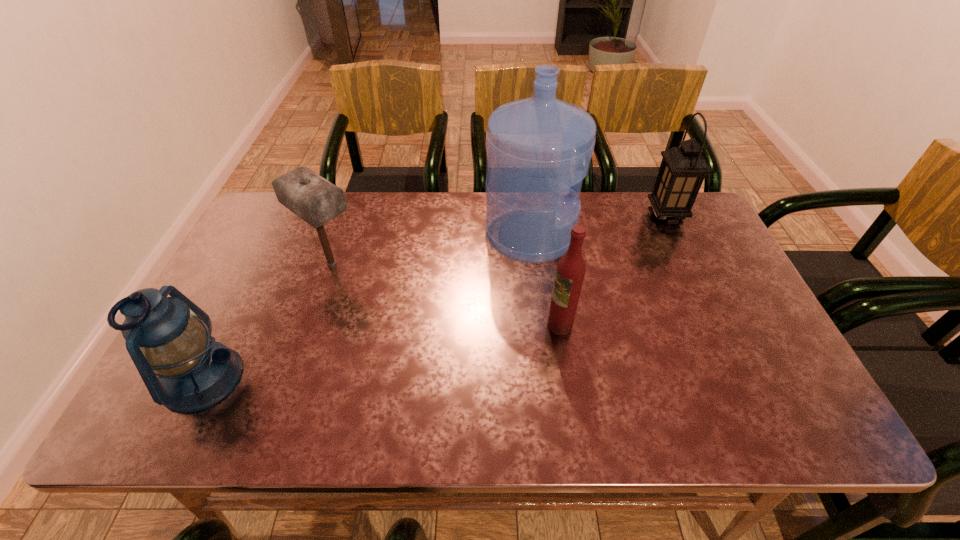
The image size is (960, 540). What are the coordinates of `object located at the far right corner` in the screenshot? It's located at (683, 169).

Where is `vacant space at the far edge of the desktop`? vacant space at the far edge of the desktop is located at coordinates (372, 218).

The height and width of the screenshot is (540, 960). Find the location of `vacant region at the near edge of the desktop`. vacant region at the near edge of the desktop is located at coordinates (565, 408).

At what (x,y) coordinates should I click in order to perform the action: click on vacant space at the left edge of the desktop. Please return your answer as a coordinate pair (x, y). Looking at the image, I should click on (292, 254).

At what (x,y) coordinates should I click in order to perform the action: click on vacant space at the right edge of the desktop. Please return your answer as a coordinate pair (x, y). The height and width of the screenshot is (540, 960). Looking at the image, I should click on (696, 264).

Identify the location of free location at the far left corner of the desktop. This screenshot has width=960, height=540. (275, 224).

Locate an element on the screen. The width and height of the screenshot is (960, 540). vacant area between the shorter lantern and the farther lantern is located at coordinates (434, 297).

Find the location of a particular element. The image size is (960, 540). free space between the tallest object and the mallet is located at coordinates (431, 249).

At what (x,y) coordinates should I click in order to perform the action: click on unoccupied area between the liquor and the second object from left to right. Please return your answer as a coordinate pair (x, y). This screenshot has height=540, width=960. Looking at the image, I should click on (445, 294).

What are the coordinates of `vacant space that is in between the tallest object and the second nearest object` in the screenshot? It's located at 545,280.